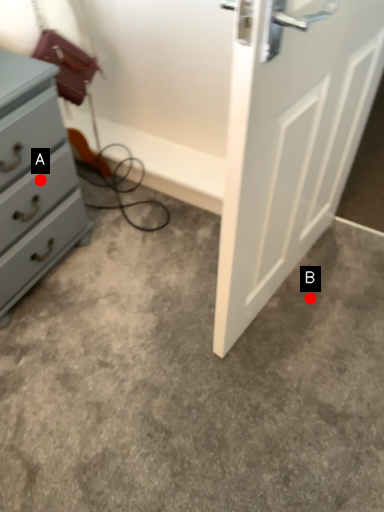
Question: Two points are circled on the image, labeled by A and B beside each circle. Which point is closer to the camera?

Choices:
 (A) A is closer
 (B) B is closer

Answer: (A)